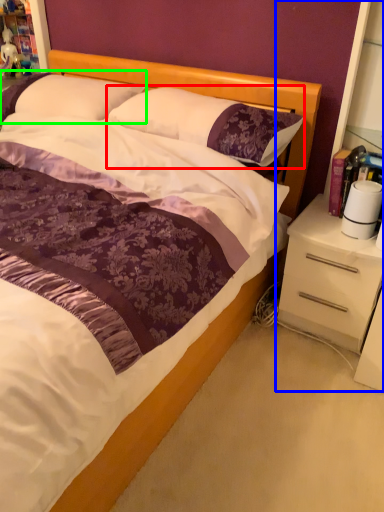
Question: Estimate the real-world distances between objects in this image. Which object is farther from pillow (highlighted by a red box), dresser (highlighted by a blue box) or pillow (highlighted by a green box)?

Choices:
 (A) dresser
 (B) pillow

Answer: (A)